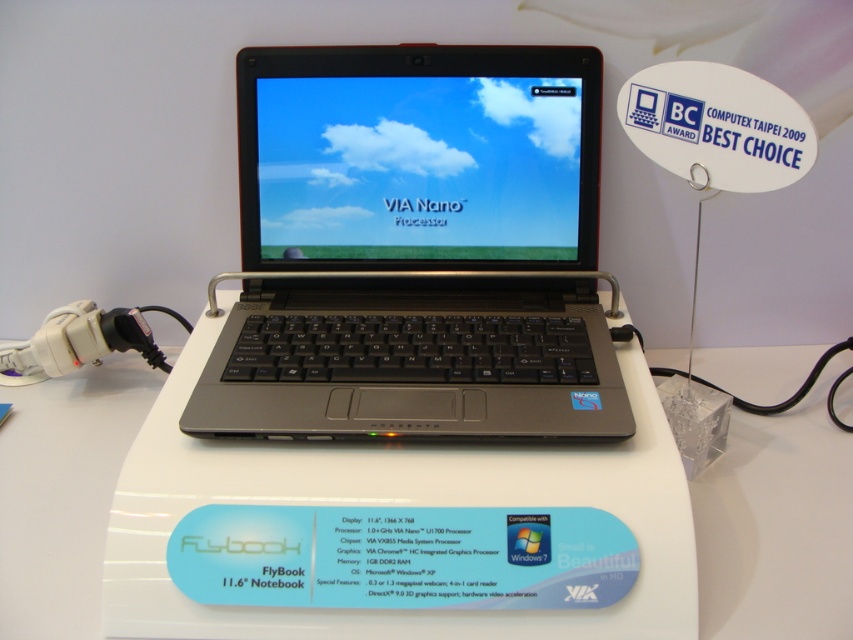
Question: Can you confirm if satin black laptop at center is positioned above white plastic table at center?

Choices:
 (A) no
 (B) yes

Answer: (B)

Question: Does satin black laptop at center appear on the left side of white plastic table at center?

Choices:
 (A) yes
 (B) no

Answer: (A)

Question: Is satin black laptop at center thinner than white plastic table at center?

Choices:
 (A) no
 (B) yes

Answer: (A)